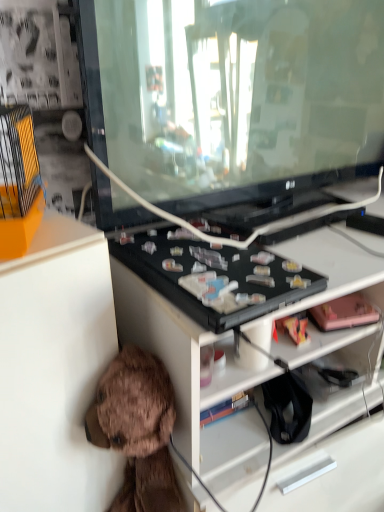
Question: From the image's perspective, is brown plush toy at lower left, positioned as the 2th toy in top-to-bottom order, on pink matte toy at right, which is the second toy in bottom-to-top order?

Choices:
 (A) no
 (B) yes

Answer: (A)

Question: Could you tell me if brown plush toy at lower left, which is the 1th toy in left-to-right order, is facing pink matte toy at right, which is the first toy in top-to-bottom order?

Choices:
 (A) yes
 (B) no

Answer: (B)

Question: Is brown plush toy at lower left, positioned as the 2th toy in top-to-bottom order, in front of pink matte toy at right, placed as the 2th toy when sorted from left to right?

Choices:
 (A) yes
 (B) no

Answer: (A)

Question: From a real-world perspective, is brown plush toy at lower left, positioned as the 2th toy in top-to-bottom order, over pink matte toy at right, which is the first toy in top-to-bottom order?

Choices:
 (A) no
 (B) yes

Answer: (A)

Question: Can you confirm if brown plush toy at lower left, positioned as the 2th toy in top-to-bottom order, is thinner than pink matte toy at right, placed as the 2th toy when sorted from left to right?

Choices:
 (A) no
 (B) yes

Answer: (A)

Question: From the image's perspective, is white matte cabinet at lower left located above or below pink matte toy at right, placed as the 2th toy when sorted from left to right?

Choices:
 (A) below
 (B) above

Answer: (A)

Question: Considering the relative positions of white matte cabinet at lower left and pink matte toy at right, which is the second toy in bottom-to-top order, in the image provided, is white matte cabinet at lower left to the left or to the right of pink matte toy at right, which is the second toy in bottom-to-top order,?

Choices:
 (A) left
 (B) right

Answer: (A)

Question: From a real-world perspective, is white matte cabinet at lower left positioned above or below pink matte toy at right, placed as the 2th toy when sorted from left to right?

Choices:
 (A) above
 (B) below

Answer: (B)

Question: Considering the positions of white matte cabinet at lower left and pink matte toy at right, which is the second toy in bottom-to-top order, in the image, is white matte cabinet at lower left bigger or smaller than pink matte toy at right, which is the second toy in bottom-to-top order,?

Choices:
 (A) small
 (B) big

Answer: (B)

Question: In the image, is transparent glass tv at center on the left side or the right side of brown plush toy at lower left, positioned as the 2th toy in top-to-bottom order?

Choices:
 (A) right
 (B) left

Answer: (A)

Question: From a real-world perspective, is transparent glass tv at center physically located above or below brown plush toy at lower left, which is the 1th toy in left-to-right order?

Choices:
 (A) above
 (B) below

Answer: (A)

Question: From the image's perspective, is transparent glass tv at center located above or below brown plush toy at lower left, the 2th toy positioned from the right?

Choices:
 (A) above
 (B) below

Answer: (A)

Question: Would you say transparent glass tv at center is inside or outside brown plush toy at lower left, the 2th toy positioned from the right?

Choices:
 (A) inside
 (B) outside

Answer: (B)

Question: Is white matte cabinet at lower left bigger or smaller than brown plush toy at lower left, which is the 1th toy in left-to-right order?

Choices:
 (A) big
 (B) small

Answer: (A)

Question: Considering the positions of white matte cabinet at lower left and brown plush toy at lower left, positioned as the 2th toy in top-to-bottom order, in the image, is white matte cabinet at lower left wider or thinner than brown plush toy at lower left, positioned as the 2th toy in top-to-bottom order,?

Choices:
 (A) wide
 (B) thin

Answer: (A)